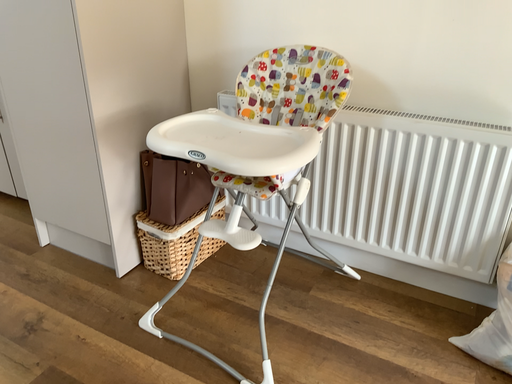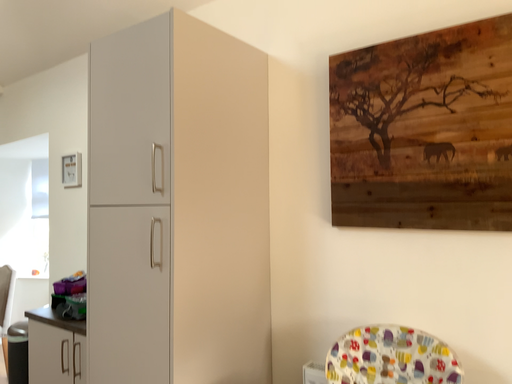
Question: Which way did the camera rotate in the video?

Choices:
 (A) rotated right
 (B) rotated left

Answer: (B)